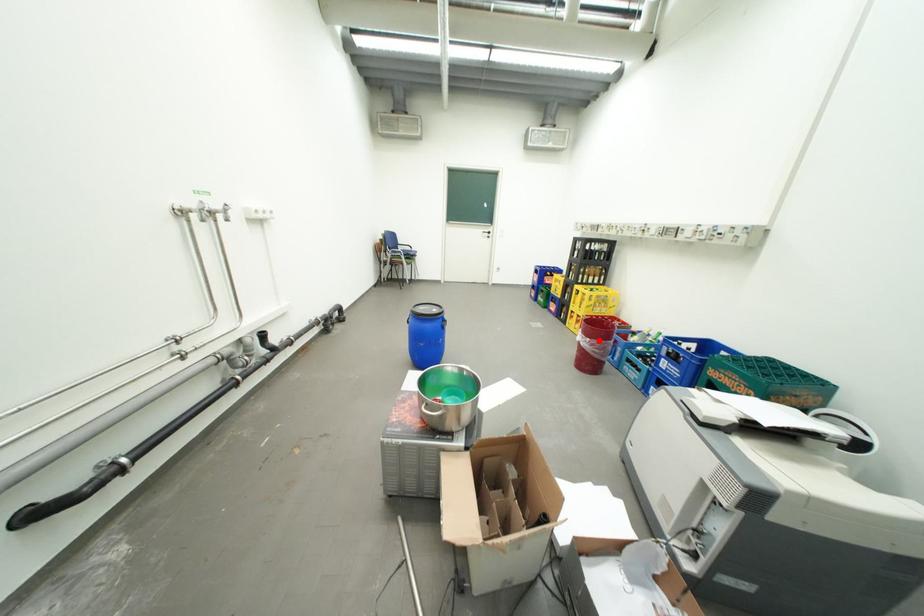
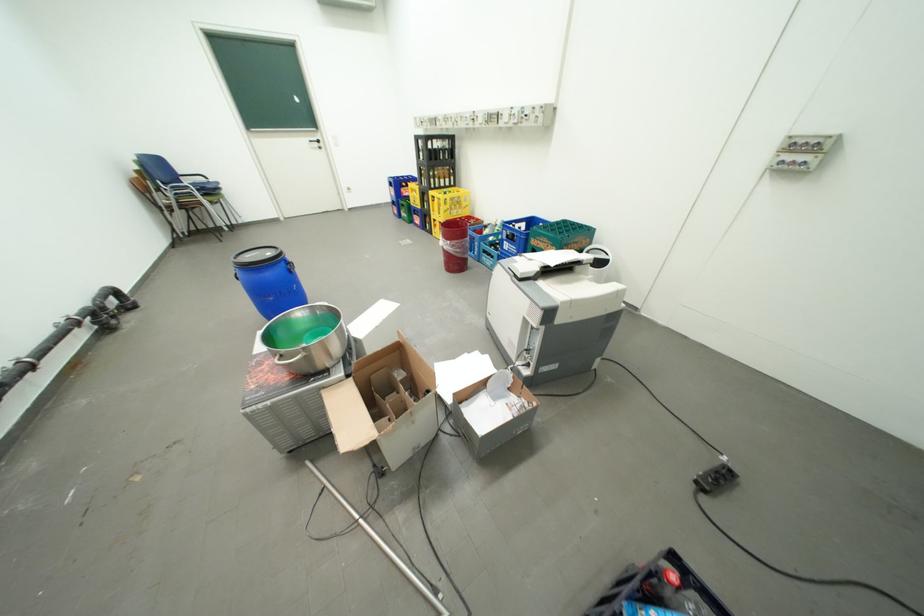
Question: I am providing you with two images of the same scene from different viewpoints. Given a red point in image1, look at the same physical point in image2. Is it:

Choices:
 (A) Closer to the viewpoint
 (B) Farther from the viewpoint

Answer: (B)